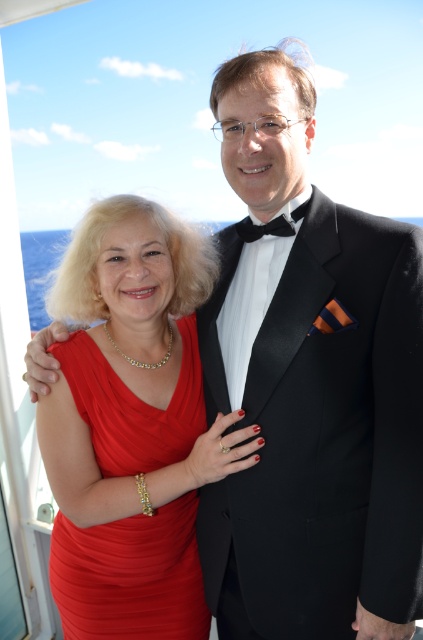
You are a photographer trying to capture the shiny red dress at center in the image. Based on the coordinates provided, where should you focus your camera? Please provide the coordinates in the format of a point like this example format of point format is point followed by parentheses with two decimal numbers separated by a comma. For instance, point example would be point (x=131, y=577).

The coordinates for the shiny red dress at center are point (x=131, y=577).

You are a photographer taking a photo of both the black satin bow tie at center and the black satin bow tie at upper center. Which bow tie should you focus on to ensure it appears larger in the photo?

The black satin bow tie at center is much taller than the black satin bow tie at upper center, so focusing on it will make it appear larger in the photo.